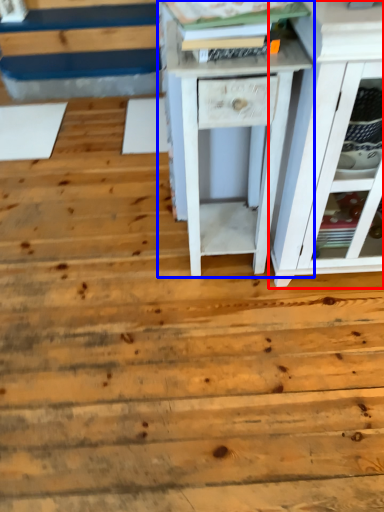
Question: Which of the following is the farthest to the observer, chest of drawers (highlighted by a red box) or nightstand (highlighted by a blue box)?

Choices:
 (A) chest of drawers
 (B) nightstand

Answer: (B)